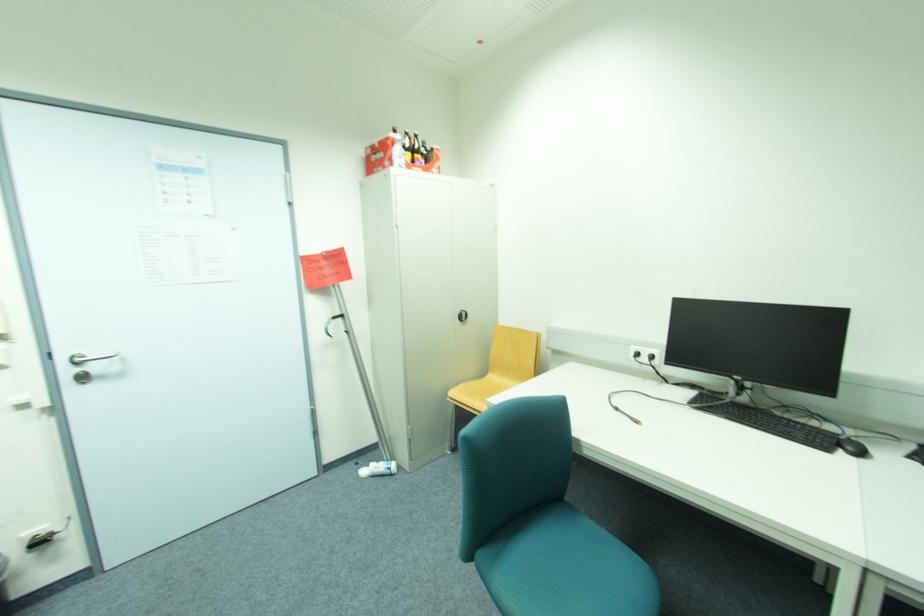
Describe the element at coordinates (566, 570) in the screenshot. This screenshot has width=924, height=616. I see `the teal chair sitting surface` at that location.